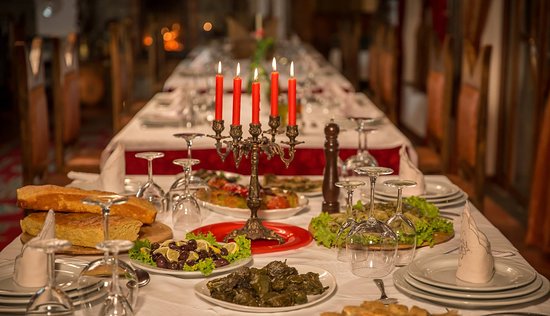
Where is `table cover`? Image resolution: width=550 pixels, height=316 pixels. table cover is located at coordinates (134, 135).